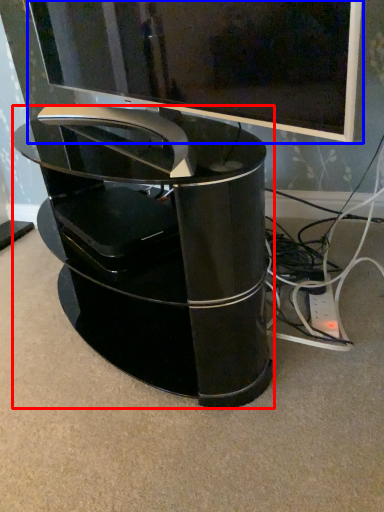
Question: Which object appears closest to the camera in this image, furniture (highlighted by a red box) or television (highlighted by a blue box)?

Choices:
 (A) furniture
 (B) television

Answer: (B)